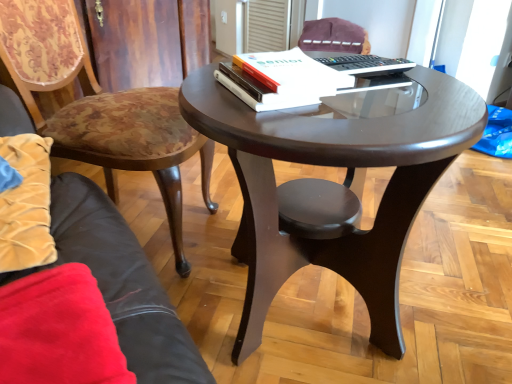
Describe the element at coordinates (293, 73) in the screenshot. The width and height of the screenshot is (512, 384). I see `white paper at upper center` at that location.

Where is `velvet floral chair at left, which is counted as the 1th chair, starting from the bottom`? velvet floral chair at left, which is counted as the 1th chair, starting from the bottom is located at coordinates (99, 108).

The height and width of the screenshot is (384, 512). In order to click on white plastic remote control at upper center in this screenshot , I will do `click(366, 65)`.

Locate an element on the screen. The width and height of the screenshot is (512, 384). shiny dark wood coffee table at center is located at coordinates (333, 165).

From a real-world perspective, is shiny dark wood coffee table at center on velvet floral chair at left, acting as the second chair starting from the top?

Actually, shiny dark wood coffee table at center is physically below velvet floral chair at left, acting as the second chair starting from the top, in the real world.

Considering the positions of points (361, 140) and (8, 1), is point (361, 140) farther from camera compared to point (8, 1)?

No, it is not.

Is shiny dark wood coffee table at center far away from velvet floral chair at left, which is counted as the 1th chair, starting from the bottom?

Actually, shiny dark wood coffee table at center and velvet floral chair at left, which is counted as the 1th chair, starting from the bottom, are a little close together.

Is shiny dark wood coffee table at center facing towards velvet floral chair at left, which is the 1th chair in front-to-back order?

No, shiny dark wood coffee table at center is not oriented towards velvet floral chair at left, which is the 1th chair in front-to-back order.

Considering the sizes of velvet floral chair at left, which is the 1th chair in front-to-back order, and white paper at upper center in the image, is velvet floral chair at left, which is the 1th chair in front-to-back order, wider or thinner than white paper at upper center?

In the image, velvet floral chair at left, which is the 1th chair in front-to-back order, appears to be wider than white paper at upper center.

Based on the photo, from the image's perspective, between velvet floral chair at left, which is counted as the 1th chair, starting from the bottom, and white paper at upper center, who is located below?

velvet floral chair at left, which is counted as the 1th chair, starting from the bottom.

Is point (29, 86) more distant than point (332, 75)?

Yes, point (29, 86) is farther from viewer.

Would you consider velvet floral chair at left, acting as the second chair starting from the right, to be distant from white paper at upper center?

velvet floral chair at left, acting as the second chair starting from the right, is actually quite close to white paper at upper center.

Between velvet floral chair at left, which is counted as the 1th chair, starting from the bottom, and velvet purple chair at upper center, which is the 1th chair in top-to-bottom order, which one has smaller width?

velvet purple chair at upper center, which is the 1th chair in top-to-bottom order.

Is velvet floral chair at left, arranged as the second chair when viewed from the back, oriented away from velvet purple chair at upper center, which ranks as the second chair in front-to-back order?

velvet floral chair at left, arranged as the second chair when viewed from the back, is not turned away from velvet purple chair at upper center, which ranks as the second chair in front-to-back order.

Is velvet floral chair at left, which is the 1th chair in front-to-back order, positioned beyond the bounds of velvet purple chair at upper center, which is counted as the 2th chair, starting from the bottom?

That's correct, velvet floral chair at left, which is the 1th chair in front-to-back order, is outside of velvet purple chair at upper center, which is counted as the 2th chair, starting from the bottom.

Is velvet floral chair at left, acting as the second chair starting from the top, far away from velvet purple chair at upper center, which is the 1th chair in top-to-bottom order?

Absolutely, velvet floral chair at left, acting as the second chair starting from the top, is distant from velvet purple chair at upper center, which is the 1th chair in top-to-bottom order.

Which object is positioned more to the right, white plastic remote control at upper center or velvet floral chair at left, arranged as the second chair when viewed from the back?

white plastic remote control at upper center is more to the right.

Is white plastic remote control at upper center further to the viewer compared to velvet floral chair at left, which ranks as the 1th chair in left-to-right order?

Yes, the depth of white plastic remote control at upper center is greater than that of velvet floral chair at left, which ranks as the 1th chair in left-to-right order.

Locate an element on the screen. The width and height of the screenshot is (512, 384). laptop keyboard behind the velvet floral chair at left, acting as the second chair starting from the right is located at coordinates (366, 65).

Who is smaller, white plastic remote control at upper center or velvet floral chair at left, which is counted as the 1th chair, starting from the bottom?

Smaller between the two is white plastic remote control at upper center.

Which is correct: white plastic remote control at upper center is inside velvet purple chair at upper center, which ranks as the second chair in front-to-back order, or outside of it?

white plastic remote control at upper center is not enclosed by velvet purple chair at upper center, which ranks as the second chair in front-to-back order.

Is white plastic remote control at upper center looking in the opposite direction of velvet purple chair at upper center, which is counted as the 2th chair, starting from the bottom?

No, white plastic remote control at upper center's orientation is not away from velvet purple chair at upper center, which is counted as the 2th chair, starting from the bottom.

Which of these two, white plastic remote control at upper center or velvet purple chair at upper center, which ranks as the 1th chair in back-to-front order, is bigger?

velvet purple chair at upper center, which ranks as the 1th chair in back-to-front order.

From the image's perspective, is white plastic remote control at upper center located above velvet purple chair at upper center, which is counted as the 2th chair, starting from the bottom?

Actually, white plastic remote control at upper center appears below velvet purple chair at upper center, which is counted as the 2th chair, starting from the bottom, in the image.

From the image's perspective, is velvet purple chair at upper center, which appears as the 2th chair when viewed from the left, on shiny dark wood coffee table at center?

Yes.

Is velvet purple chair at upper center, which ranks as the second chair in front-to-back order, taller or shorter than shiny dark wood coffee table at center?

In the image, velvet purple chair at upper center, which ranks as the second chair in front-to-back order, appears to be shorter than shiny dark wood coffee table at center.

The height and width of the screenshot is (384, 512). What are the coordinates of `the 2nd chair above the shiny dark wood coffee table at center (from a real-world perspective)` in the screenshot? It's located at (334, 36).

Between velvet purple chair at upper center, which is counted as the 2th chair, starting from the bottom, and shiny dark wood coffee table at center, which one has larger width?

shiny dark wood coffee table at center.

From the image's perspective, is white paper at upper center beneath velvet floral chair at left, which is counted as the 1th chair, starting from the bottom?

No, from the image's perspective, white paper at upper center is not beneath velvet floral chair at left, which is counted as the 1th chair, starting from the bottom.

Does white paper at upper center appear on the left side of velvet floral chair at left, which is the 1th chair in front-to-back order?

Incorrect, white paper at upper center is not on the left side of velvet floral chair at left, which is the 1th chair in front-to-back order.

Measure the distance between white paper at upper center and velvet floral chair at left, acting as the second chair starting from the right.

white paper at upper center and velvet floral chair at left, acting as the second chair starting from the right, are 45.93 centimeters apart.

Which of these two, white paper at upper center or velvet floral chair at left, which ranks as the 1th chair in left-to-right order, is wider?

With larger width is velvet floral chair at left, which ranks as the 1th chair in left-to-right order.

This screenshot has height=384, width=512. I want to click on coffee table located in front of the velvet floral chair at left, which ranks as the 1th chair in left-to-right order, so click(x=333, y=165).

In the image, there is a velvet floral chair at left, arranged as the second chair when viewed from the back. Identify the location of paperback book above it (from the image's perspective). The height and width of the screenshot is (384, 512). (293, 73).

From the image, which object appears to be farther from white plastic remote control at upper center, white paper at upper center or shiny dark wood coffee table at center?

shiny dark wood coffee table at center lies further to white plastic remote control at upper center than the other object.

When comparing their distances from shiny dark wood coffee table at center, does velvet floral chair at left, which is the 1th chair in front-to-back order, or white plastic remote control at upper center seem further?

velvet floral chair at left, which is the 1th chair in front-to-back order, is further to shiny dark wood coffee table at center.

Considering their positions, is velvet purple chair at upper center, which ranks as the second chair in front-to-back order, positioned closer to white paper at upper center than shiny dark wood coffee table at center?

shiny dark wood coffee table at center is positioned closer to the anchor white paper at upper center.

Looking at the image, which one is located further to velvet purple chair at upper center, which appears as the 2th chair when viewed from the left, velvet floral chair at left, arranged as the second chair when viewed from the back, or white paper at upper center?

Based on the image, white paper at upper center appears to be further to velvet purple chair at upper center, which appears as the 2th chair when viewed from the left.

Based on their spatial positions, is velvet purple chair at upper center, which appears as the 2th chair when viewed from the left, or shiny dark wood coffee table at center closer to white plastic remote control at upper center?

Among the two, shiny dark wood coffee table at center is located nearer to white plastic remote control at upper center.

When comparing their distances from velvet floral chair at left, arranged as the second chair when viewed from the back, does white plastic remote control at upper center or shiny dark wood coffee table at center seem closer?

Among the two, shiny dark wood coffee table at center is located nearer to velvet floral chair at left, arranged as the second chair when viewed from the back.

Based on their spatial positions, is white paper at upper center or velvet purple chair at upper center, which ranks as the second chair in front-to-back order, closer to velvet floral chair at left, acting as the second chair starting from the right?

white paper at upper center.

Looking at the image, which one is located closer to velvet floral chair at left, which is counted as the 1th chair, starting from the bottom, velvet purple chair at upper center, which ranks as the second chair in front-to-back order, or white paper at upper center?

white paper at upper center is closer to velvet floral chair at left, which is counted as the 1th chair, starting from the bottom.

Image resolution: width=512 pixels, height=384 pixels. I want to click on chair located between shiny dark wood coffee table at center and velvet purple chair at upper center, which is counted as the 2th chair, starting from the bottom, in the depth direction, so click(x=99, y=108).

I want to click on coffee table between velvet floral chair at left, acting as the second chair starting from the top, and white plastic remote control at upper center, in the horizontal direction, so 333,165.

The width and height of the screenshot is (512, 384). Identify the location of paperback book between shiny dark wood coffee table at center and velvet purple chair at upper center, which appears as the 2th chair when viewed from the left, in the front-back direction. click(293, 73).

You are a GUI agent. You are given a task and a screenshot of the screen. Output one action in this format:
    pyautogui.click(x=<x>, y=<y>)
    Task: Click on the paperback book situated between velvet floral chair at left, acting as the second chair starting from the top, and shiny dark wood coffee table at center from left to right
    This screenshot has height=384, width=512.
    Given the screenshot: What is the action you would take?
    pyautogui.click(x=293, y=73)